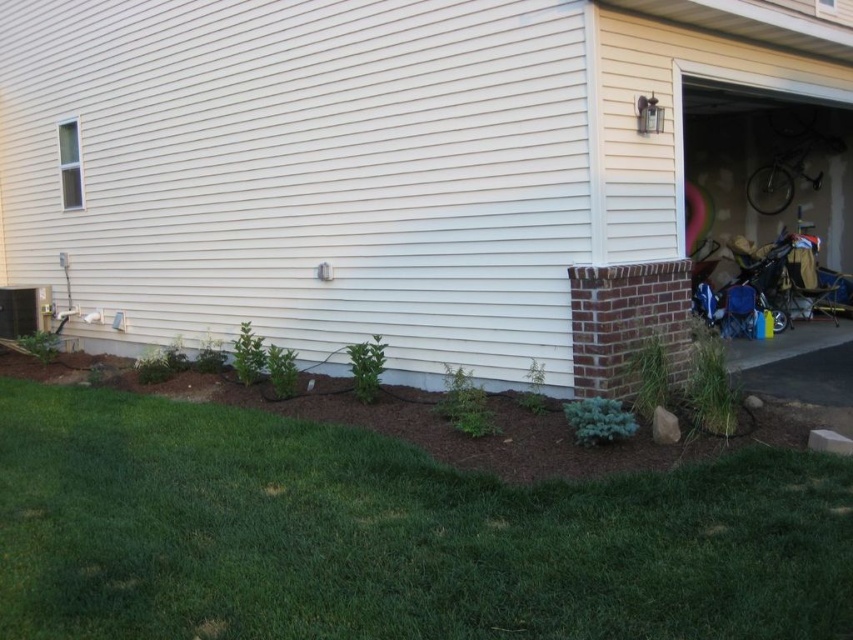
Question: Which point is farther to the camera?

Choices:
 (A) green grass at lower left
 (B) matte white garage at center

Answer: (B)

Question: Observing the image, what is the correct spatial positioning of matte white garage at center in reference to green grass at lower left?

Choices:
 (A) left
 (B) right

Answer: (A)

Question: Does matte white garage at center appear on the left side of green grass at lower left?

Choices:
 (A) yes
 (B) no

Answer: (A)

Question: Which point is closer to the camera taking this photo?

Choices:
 (A) (820, 506)
 (B) (767, 118)

Answer: (A)

Question: Does matte white garage at center have a lesser width compared to green grass at lower left?

Choices:
 (A) yes
 (B) no

Answer: (B)